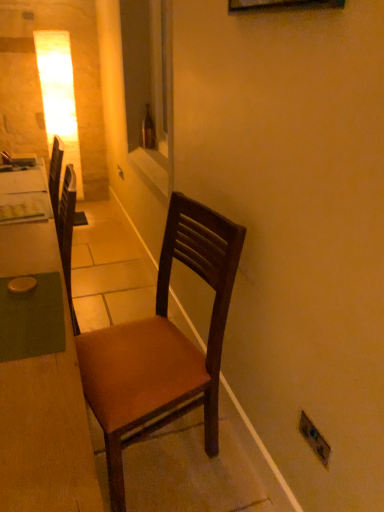
Question: From a real-world perspective, is brown glass bottle at center physically above brown leather chair at center?

Choices:
 (A) yes
 (B) no

Answer: (A)

Question: Considering the relative sizes of brown glass bottle at center and brown leather chair at center in the image provided, is brown glass bottle at center taller than brown leather chair at center?

Choices:
 (A) no
 (B) yes

Answer: (A)

Question: Is brown glass bottle at center not within brown leather chair at center?

Choices:
 (A) yes
 (B) no

Answer: (A)

Question: From the image's perspective, does brown glass bottle at center appear higher than brown leather chair at center?

Choices:
 (A) yes
 (B) no

Answer: (A)

Question: Would you say brown glass bottle at center contains brown leather chair at center?

Choices:
 (A) yes
 (B) no

Answer: (B)

Question: From a real-world perspective, relative to white glossy window sill at center, is brown leather chair at center vertically above or below?

Choices:
 (A) above
 (B) below

Answer: (B)

Question: From the image's perspective, is brown leather chair at center positioned above or below white glossy window sill at center?

Choices:
 (A) below
 (B) above

Answer: (A)

Question: Is point (150, 357) positioned closer to the camera than point (137, 166)?

Choices:
 (A) farther
 (B) closer

Answer: (B)

Question: In terms of width, does brown leather chair at center look wider or thinner when compared to white glossy window sill at center?

Choices:
 (A) thin
 (B) wide

Answer: (B)

Question: In the image, is wooden desk at left positioned in front of or behind brown leather chair at center?

Choices:
 (A) behind
 (B) front

Answer: (B)

Question: Is wooden desk at left to the left or to the right of brown leather chair at center in the image?

Choices:
 (A) left
 (B) right

Answer: (A)

Question: Is wooden desk at left bigger or smaller than brown leather chair at center?

Choices:
 (A) big
 (B) small

Answer: (A)

Question: Considering the positions of wooden desk at left and brown leather chair at center in the image, is wooden desk at left wider or thinner than brown leather chair at center?

Choices:
 (A) thin
 (B) wide

Answer: (B)

Question: Is point (145, 358) closer or farther from the camera than point (41, 481)?

Choices:
 (A) closer
 (B) farther

Answer: (B)

Question: Is brown leather chair at center wider or thinner than wooden desk at left?

Choices:
 (A) wide
 (B) thin

Answer: (B)